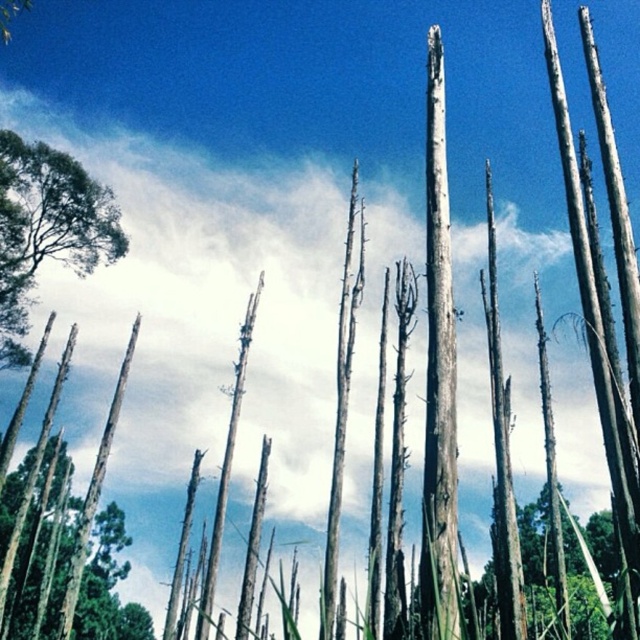
Question: Is smooth brown tree trunk at lower left in front of green leafy tree at left?

Choices:
 (A) yes
 (B) no

Answer: (A)

Question: Which point is farther to the camera?

Choices:
 (A) smooth brown tree trunk at lower left
 (B) gray rough bark tree trunk at center
 (C) green leafy tree at left

Answer: (C)

Question: Can you confirm if gray rough bark tree trunk at center is positioned to the left of smooth brown tree trunk at lower left?

Choices:
 (A) yes
 (B) no

Answer: (B)

Question: Which is farther from the smooth brown tree trunk at lower left?

Choices:
 (A) gray rough bark tree trunk at center
 (B) green leafy tree at left

Answer: (A)

Question: Which object is positioned closest to the smooth brown tree trunk at lower left?

Choices:
 (A) green leafy tree at left
 (B) gray rough bark tree trunk at center

Answer: (A)

Question: Is gray rough bark tree trunk at center smaller than green leafy tree at left?

Choices:
 (A) yes
 (B) no

Answer: (B)